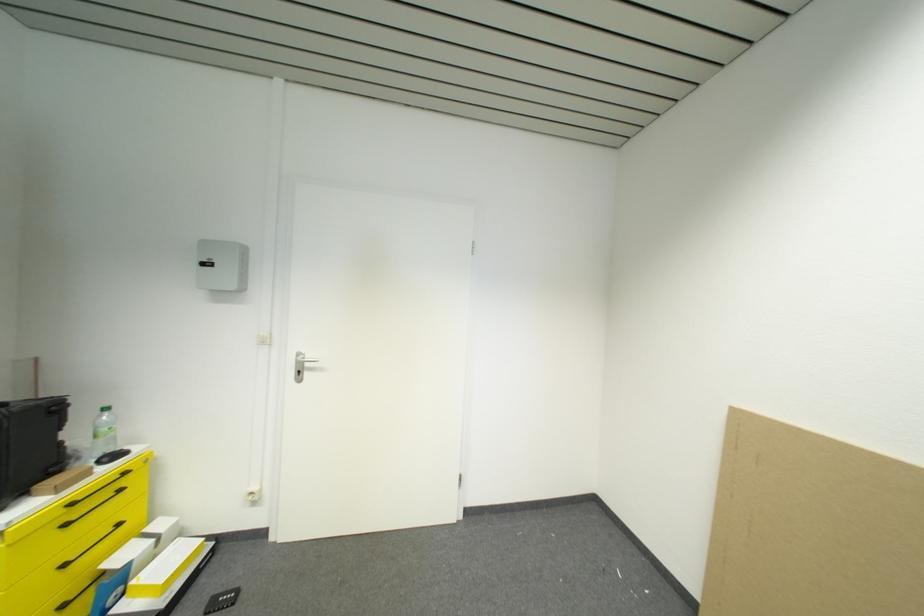
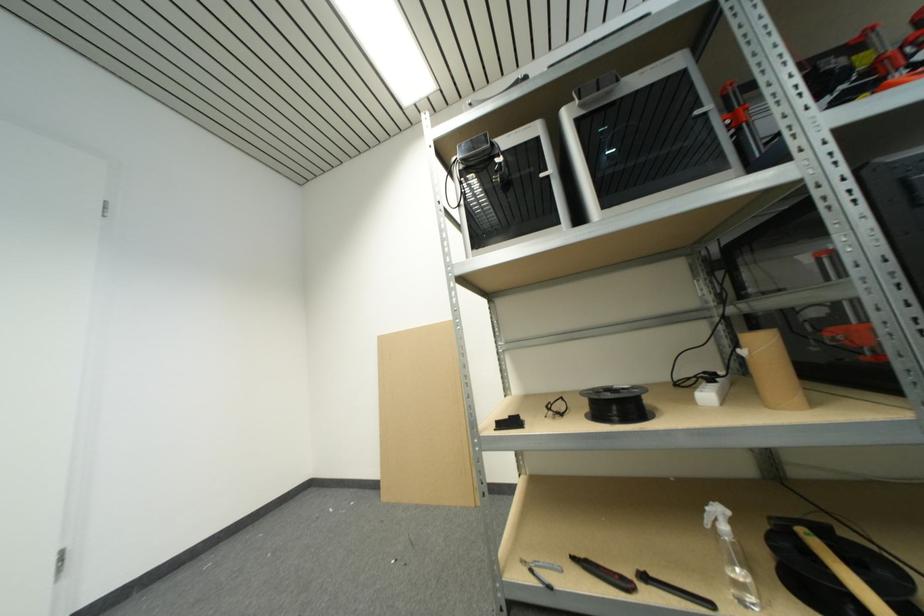
Question: The camera is either moving clockwise (left) or counter-clockwise (right) around the object. The first image is from the beginning of the video and the second image is from the end. Is the camera moving left or right when shooting the video?

Choices:
 (A) Left
 (B) Right

Answer: (A)